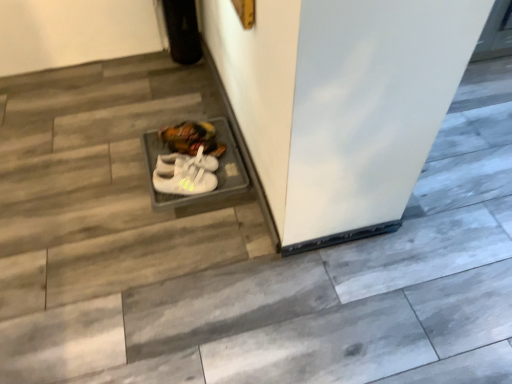
What are the coordinates of `white matte sneakers at center` in the screenshot? It's located at (185, 173).

What do you see at coordinates (185, 173) in the screenshot?
I see `white matte sneakers at center` at bounding box center [185, 173].

The height and width of the screenshot is (384, 512). Find the location of `white matte sneakers at center`. white matte sneakers at center is located at coordinates (x=185, y=173).